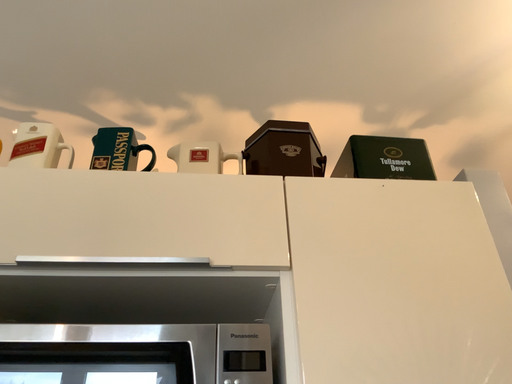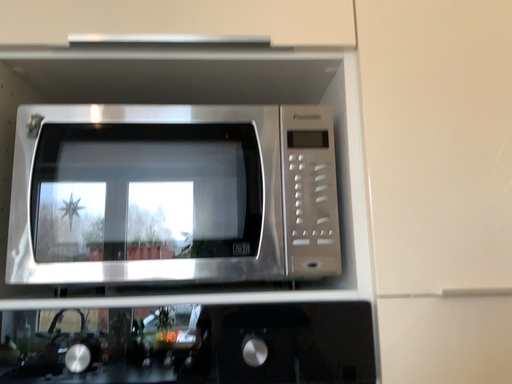
Question: How did the camera likely rotate when shooting the video?

Choices:
 (A) rotated upward
 (B) rotated downward

Answer: (B)